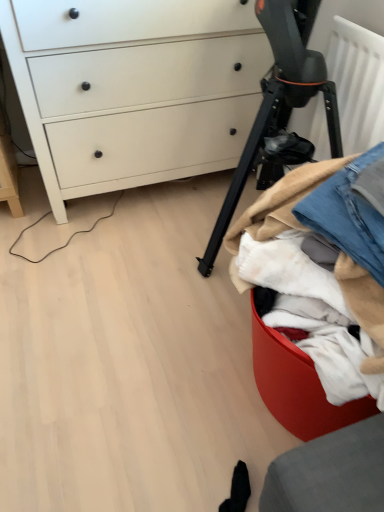
At what (x,y) coordinates should I click in order to perform the action: click on denim fabric at right. Please return your answer as a coordinate pair (x, y). Looking at the image, I should click on (314, 284).

Where is `black matte tripod at center`? The width and height of the screenshot is (384, 512). black matte tripod at center is located at coordinates (279, 98).

Describe the element at coordinates (348, 216) in the screenshot. I see `denim at right` at that location.

Where is `denim at right`? The height and width of the screenshot is (512, 384). denim at right is located at coordinates (348, 216).

What do you see at coordinates (133, 88) in the screenshot? I see `white matte chest of drawers at upper left` at bounding box center [133, 88].

Where is `denim fabric at right`? denim fabric at right is located at coordinates (314, 284).

Are black matte tripod at center and white matte chest of drawers at upper left far apart?

That's not correct — black matte tripod at center is a little close to white matte chest of drawers at upper left.

From the image's perspective, is black matte tripod at center on white matte chest of drawers at upper left?

No.

Is point (269, 27) positioned after point (163, 6)?

No.

In the image, is black matte tripod at center on the left side or the right side of white matte chest of drawers at upper left?

In the image, black matte tripod at center appears on the right side of white matte chest of drawers at upper left.

Between point (243, 35) and point (293, 84), which one is positioned behind?

The point (243, 35) is behind.

Is white matte chest of drawers at upper left looking in the opposite direction of black matte tripod at center?

white matte chest of drawers at upper left does not have its back to black matte tripod at center.

Considering the relative positions of white matte chest of drawers at upper left and black matte tripod at center in the image provided, is white matte chest of drawers at upper left to the right of black matte tripod at center from the viewer's perspective?

Incorrect, white matte chest of drawers at upper left is not on the right side of black matte tripod at center.

From a real-world perspective, is white matte chest of drawers at upper left physically below black matte tripod at center?

Yes, from a real-world perspective, white matte chest of drawers at upper left is below black matte tripod at center.

Looking at their sizes, would you say denim at right is wider or thinner than black matte tripod at center?

denim at right is thinner than black matte tripod at center.

Between denim at right and black matte tripod at center, which one has more height?

Standing taller between the two is black matte tripod at center.

Can you tell me how much denim at right and black matte tripod at center differ in facing direction?

The angular difference between denim at right and black matte tripod at center is 10.2 degrees.

Do you think denim at right is within black matte tripod at center, or outside of it?

denim at right cannot be found inside black matte tripod at center.

Is white matte chest of drawers at upper left to the right of denim at right from the viewer's perspective?

No.

Consider the image. Is white matte chest of drawers at upper left next to denim at right?

white matte chest of drawers at upper left is not next to denim at right, and they're not touching.

Looking at this image, in terms of width, does white matte chest of drawers at upper left look wider or thinner when compared to denim at right?

white matte chest of drawers at upper left is wider than denim at right.

From a real-world perspective, between white matte chest of drawers at upper left and denim at right, who is vertically higher?

In real-world perspective, denim at right is above.

Can you confirm if denim fabric at right is taller than denim at right?

Yes, denim fabric at right is taller than denim at right.

Is point (355, 379) positioned before point (344, 237)?

Yes, it is.

From the image's perspective, which one is positioned lower, denim fabric at right or denim at right?

denim fabric at right.

How many degrees apart are the facing directions of denim fabric at right and denim at right?

The angular difference between denim fabric at right and denim at right is 0.00034 degrees.

Is point (377, 219) closer or farther from the camera than point (305, 191)?

Point (377, 219) is closer to the camera than point (305, 191).

From the image's perspective, which one is positioned higher, denim at right or denim fabric at right?

denim at right.

Could you tell me if denim at right is turned towards denim fabric at right?

Yes, denim at right is turned towards denim fabric at right.

Does denim at right come behind denim fabric at right?

Yes, denim at right is further from the camera.

Can we say denim fabric at right lies outside black matte tripod at center?

Absolutely, denim fabric at right is external to black matte tripod at center.

Which object is wider, denim fabric at right or black matte tripod at center?

Wider between the two is black matte tripod at center.

Based on the photo, which is behind, denim fabric at right or black matte tripod at center?

Positioned behind is black matte tripod at center.

Based on the photo, which is further, (320, 323) or (277, 162)?

The point (277, 162) is more distant.

Locate an element on the screen. Image resolution: width=384 pixels, height=512 pixels. the chest of drawers located behind the black matte tripod at center is located at coordinates (x=133, y=88).

The width and height of the screenshot is (384, 512). I want to click on tripod lying in front of the white matte chest of drawers at upper left, so click(x=279, y=98).

When comparing their distances from black matte tripod at center, does denim fabric at right or denim at right seem closer?

denim fabric at right.

Looking at the image, which one is located further to denim fabric at right, white matte chest of drawers at upper left or denim at right?

white matte chest of drawers at upper left is positioned further to the anchor denim fabric at right.

When comparing their distances from denim at right, does black matte tripod at center or white matte chest of drawers at upper left seem further?

The object further to denim at right is white matte chest of drawers at upper left.

When comparing their distances from denim fabric at right, does black matte tripod at center or denim at right seem closer?

denim at right lies closer to denim fabric at right than the other object.

Which object lies nearer to the anchor point white matte chest of drawers at upper left, denim fabric at right or denim at right?

Among the two, denim fabric at right is located nearer to white matte chest of drawers at upper left.

From the image, which object appears to be nearer to white matte chest of drawers at upper left, denim at right or black matte tripod at center?

black matte tripod at center is positioned closer to the anchor white matte chest of drawers at upper left.

Estimate the real-world distances between objects in this image. Which object is further from denim fabric at right, black matte tripod at center or white matte chest of drawers at upper left?

white matte chest of drawers at upper left is positioned further to the anchor denim fabric at right.

When comparing their distances from denim at right, does black matte tripod at center or denim fabric at right seem further?

black matte tripod at center lies further to denim at right than the other object.

Where is `tripod between white matte chest of drawers at upper left and denim fabric at right vertically`? Image resolution: width=384 pixels, height=512 pixels. tripod between white matte chest of drawers at upper left and denim fabric at right vertically is located at coordinates (279, 98).

Identify the location of jeans between white matte chest of drawers at upper left and denim fabric at right vertically. This screenshot has width=384, height=512. (348, 216).

What are the coordinates of `jeans between black matte tripod at center and denim fabric at right in the vertical direction` in the screenshot? It's located at (348, 216).

Where is `tripod between white matte chest of drawers at upper left and denim at right in the up-down direction`? This screenshot has width=384, height=512. tripod between white matte chest of drawers at upper left and denim at right in the up-down direction is located at coordinates (279, 98).